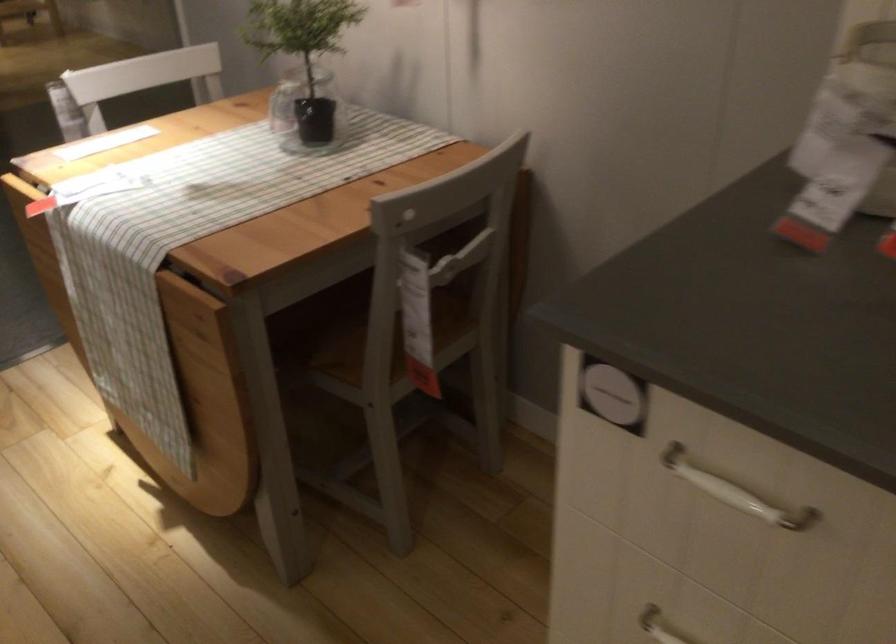
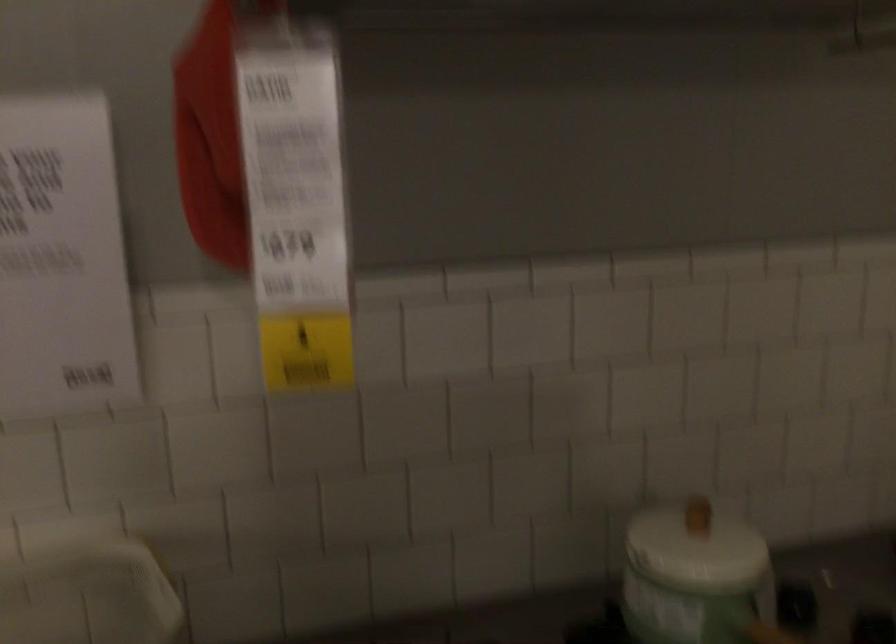
Question: The camera is either moving clockwise (left) or counter-clockwise (right) around the object. The first image is from the beginning of the video and the second image is from the end. Is the camera moving left or right when shooting the video?

Choices:
 (A) Left
 (B) Right

Answer: (A)